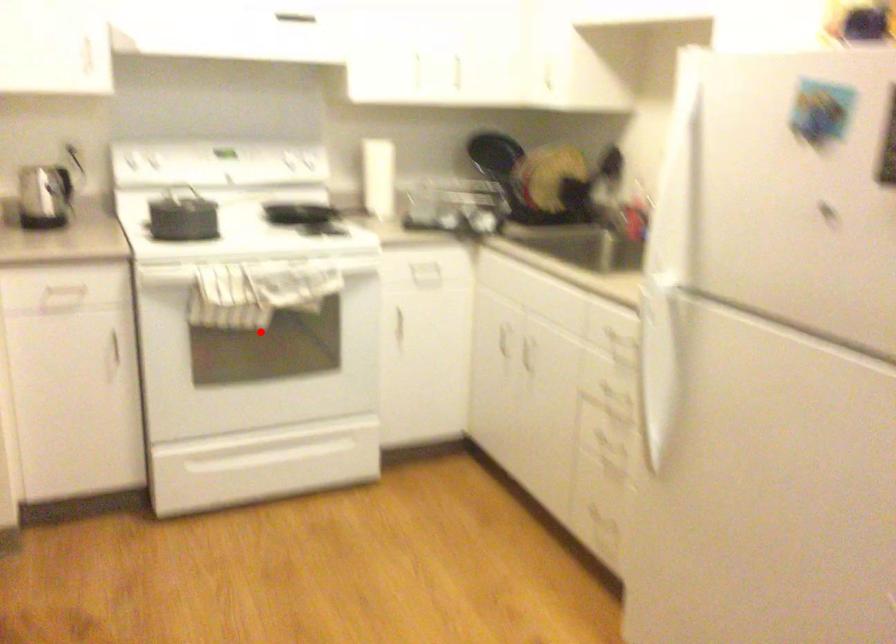
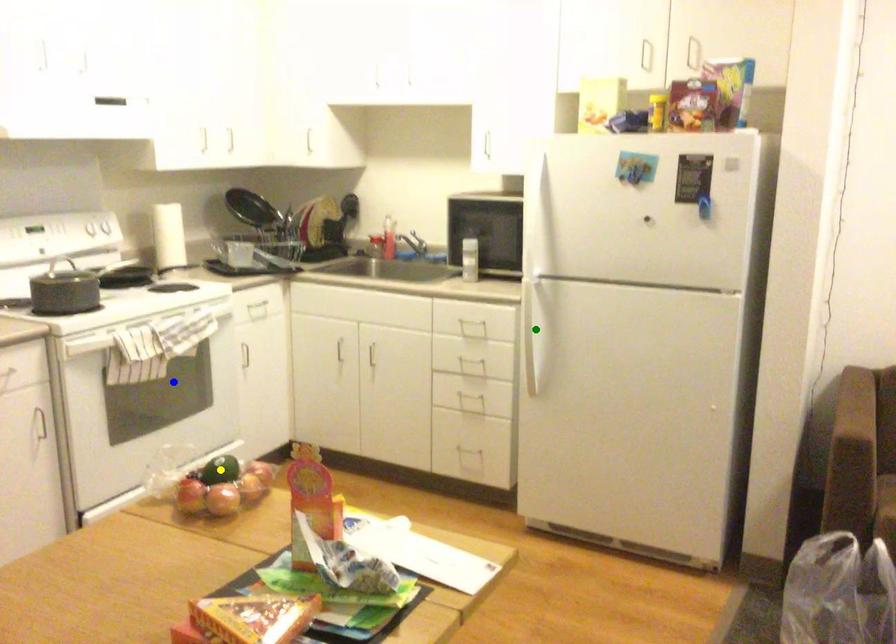
Question: I am providing you with two images of the same scene from different viewpoints. A red point is marked on the first image. You are given multiple points on the second image. Which spot in image 2 lines up with the point in image 1?

Choices:
 (A) green point
 (B) yellow point
 (C) blue point

Answer: (C)